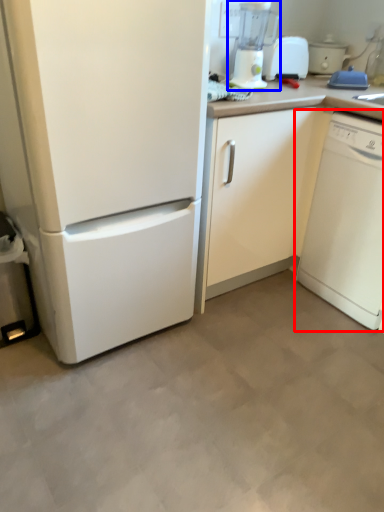
Question: Which object appears farthest to the camera in this image, dish washer (highlighted by a red box) or blender (highlighted by a blue box)?

Choices:
 (A) dish washer
 (B) blender

Answer: (B)